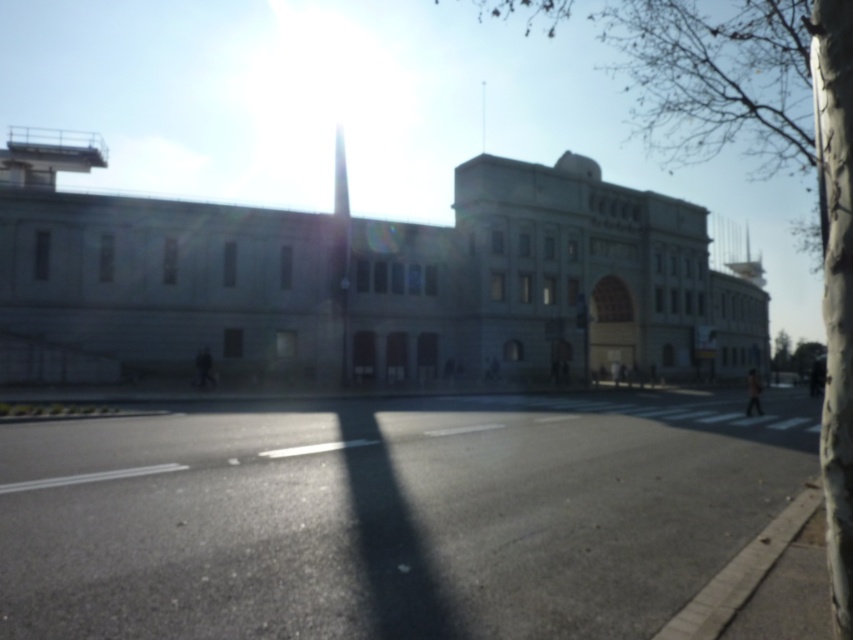
Does bare bark tree at upper right have a lesser height compared to green leafy tree at right?

In fact, bare bark tree at upper right may be taller than green leafy tree at right.

You are a GUI agent. You are given a task and a screenshot of the screen. Output one action in this format:
    pyautogui.click(x=<x>, y=<y>)
    Task: Click on the bare bark tree at upper right
    The width and height of the screenshot is (853, 640).
    Given the screenshot: What is the action you would take?
    pos(764,161)

Is point (838, 212) farther from viewer compared to point (778, 364)?

No, (838, 212) is closer to viewer.

This screenshot has width=853, height=640. Find the location of `bare bark tree at upper right`. bare bark tree at upper right is located at coordinates (764, 161).